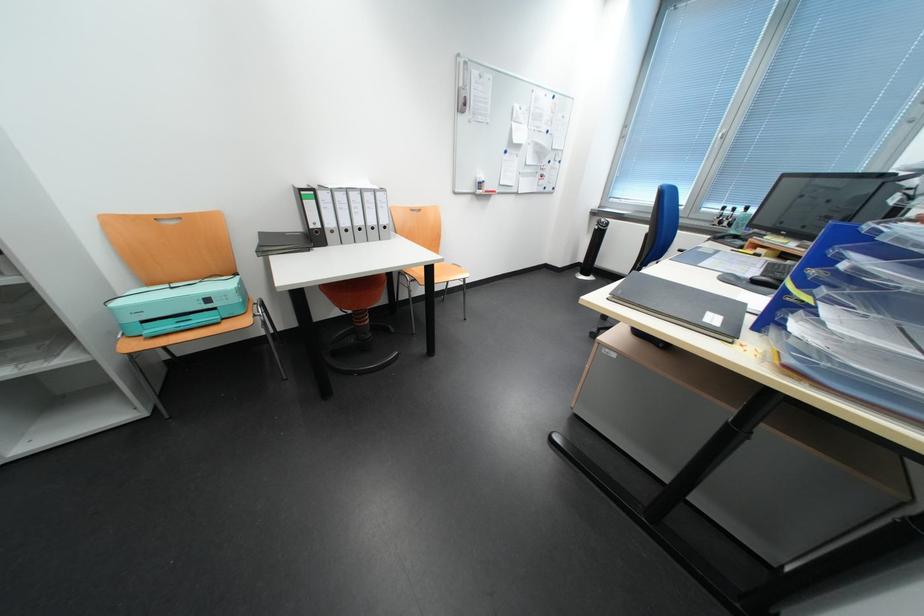
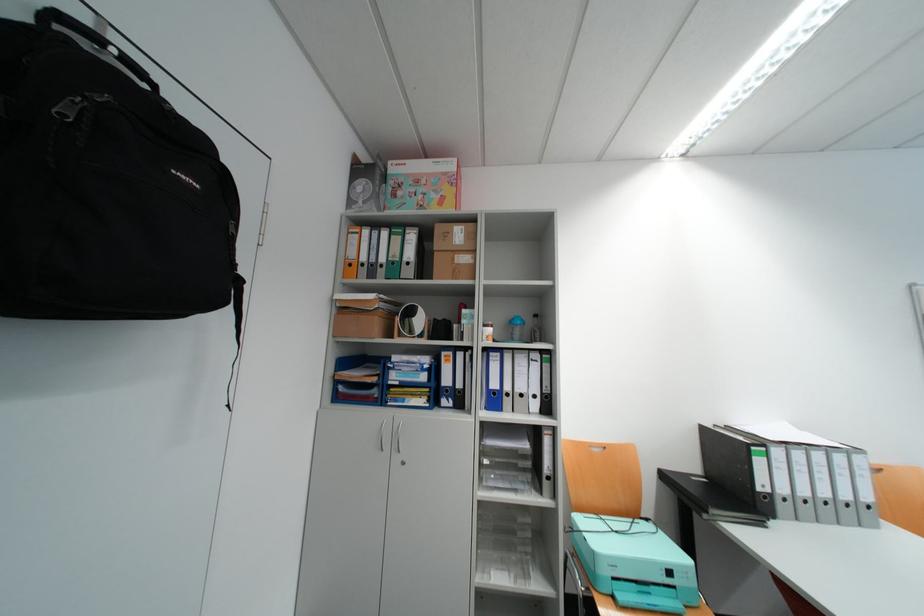
Find the pixel in the second image that matches [149,310] in the first image.

(624, 562)